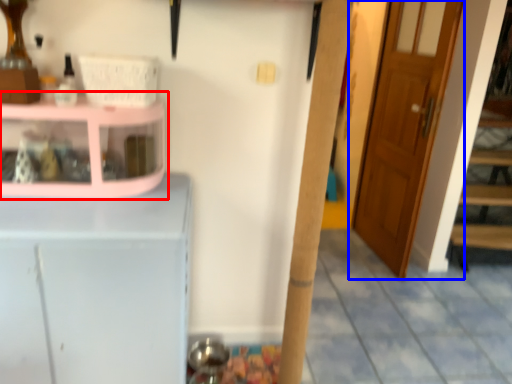
Question: Which point is closer to the camera, shelf (highlighted by a red box) or door (highlighted by a blue box)?

Choices:
 (A) shelf
 (B) door

Answer: (A)